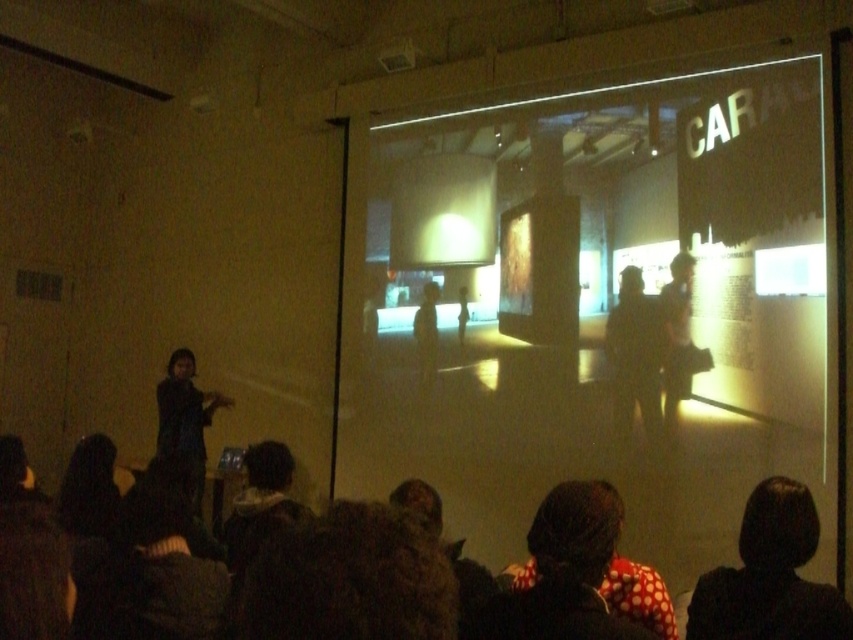
You are an event organizer and need to ensure that all attendees have enough space to move comfortably. Given that the dark hair at lower right and the dark fabric dress at left are in the front row, which of these two items occupies more horizontal space?

The dark fabric dress at left occupies more horizontal space because its width is greater than the dark hair at lower right.

You are a photographer positioned at the back of the room. You want to take a photo that includes both the dark hair at lower right and the dark gray fabric mannequin at center. Based on their distance apart, will they both fit in the frame if your camera has a standard 50mm lens?

The dark hair at lower right and the dark gray fabric mannequin at center are 11.03 feet apart. With a standard 50mm lens, the field of view is approximately 46 degrees, which can comfortably include objects 11 feet apart at typical shooting distances. Therefore, both subjects should fit within the frame.